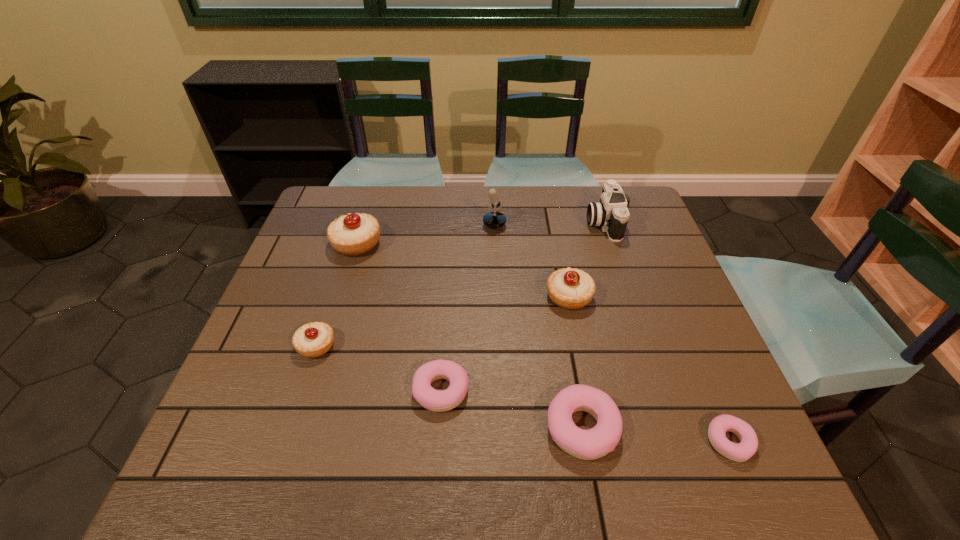
The image size is (960, 540). In order to click on free spot between the second shortest pastry and the second pink pastry from right to left in this screenshot , I will do `click(512, 409)`.

Locate an element on the screen. This screenshot has width=960, height=540. vacant area between the black camera and the smallest pink pastry is located at coordinates (666, 332).

At what (x,y) coordinates should I click in order to perform the action: click on free point between the third tallest pastry and the fifth shortest object. Please return your answer as a coordinate pair (x, y). The image size is (960, 540). Looking at the image, I should click on (443, 321).

Where is `blank region between the farthest beige pastry and the fifth shortest pastry`? The width and height of the screenshot is (960, 540). blank region between the farthest beige pastry and the fifth shortest pastry is located at coordinates 463,270.

The image size is (960, 540). I want to click on free space between the black camera and the seventh tallest object, so click(522, 306).

Find the location of a particular element. The height and width of the screenshot is (540, 960). free spot between the farthest pastry and the white microphone is located at coordinates (417, 235).

You are a GUI agent. You are given a task and a screenshot of the screen. Output one action in this format:
    pyautogui.click(x=<x>, y=<y>)
    Task: Click on the free space that is in between the second object from right to left and the microphone
    This screenshot has width=960, height=540.
    Given the screenshot: What is the action you would take?
    pyautogui.click(x=540, y=224)

Identify the location of vacant point located between the rightmost object and the third shortest object. (656, 435).

You are a GUI agent. You are given a task and a screenshot of the screen. Output one action in this format:
    pyautogui.click(x=<x>, y=<y>)
    Task: Click on the object that ranks as the fifth closest to the nearest beige pastry
    Image resolution: width=960 pixels, height=540 pixels.
    Given the screenshot: What is the action you would take?
    pyautogui.click(x=569, y=288)

Find the location of a particular element. Image resolution: width=960 pixels, height=540 pixels. object that is the second closest to the rightmost pink pastry is located at coordinates 569,288.